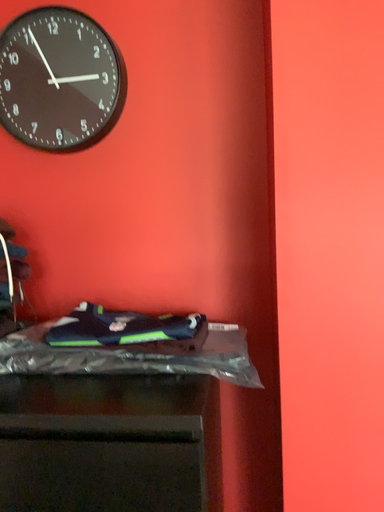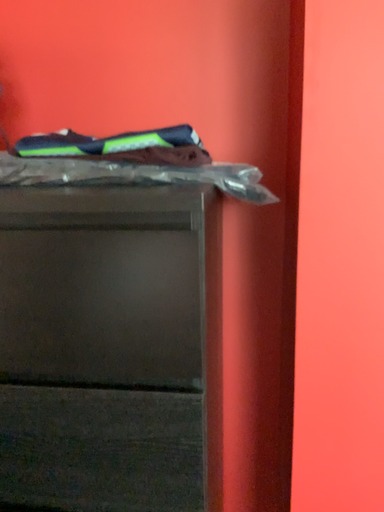
Question: How did the camera likely rotate when shooting the video?

Choices:
 (A) rotated upward
 (B) rotated downward

Answer: (B)